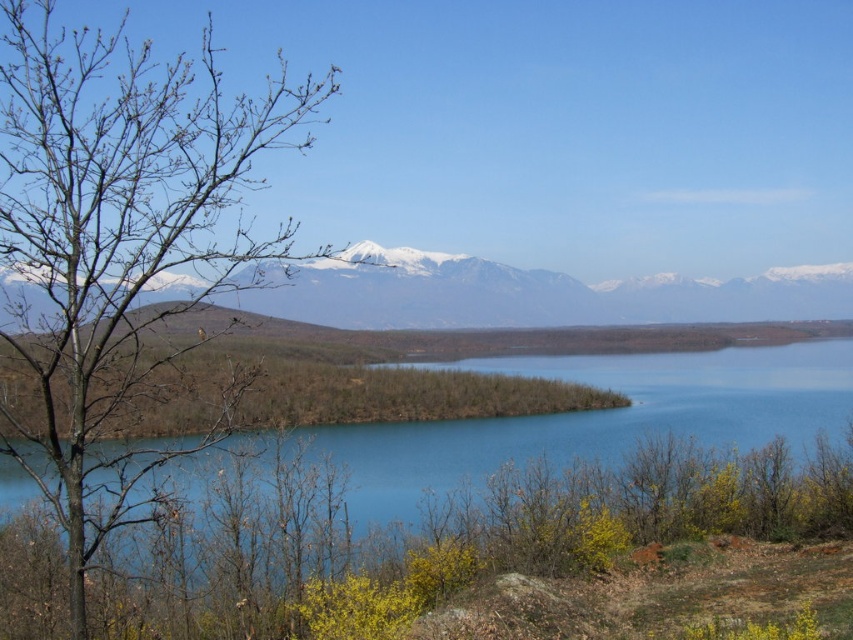
In the scene shown: You are standing at the point labeled point (117,243) in the image. What do you see immediately around you?

You see bare branches at left immediately around you.

You are standing at the point with coordinates point [332,269] and want to walk to the point with coordinates point [805,417]. According to the scene description, will you have to walk through any obstacles like trees or shrubs along the way?

Since point [805,417] is in front of point [332,269], there are no trees or shrubs blocking the path between them. The sparse distribution of trees and open view of the lake suggest a clear path.

You are standing at the edge of the lake and want to take a photo that includes both the bare branches at left and the snowy white mountain range at upper center. Based on the given distance between them, can you estimate whether they can be captured in a single frame without moving the camera?

The distance between the bare branches at left and the snowy white mountain range at upper center is 81.60 feet. Since the camera can capture a wide enough angle to include both objects separated by this distance when positioned appropriately, they can likely be captured in a single frame.